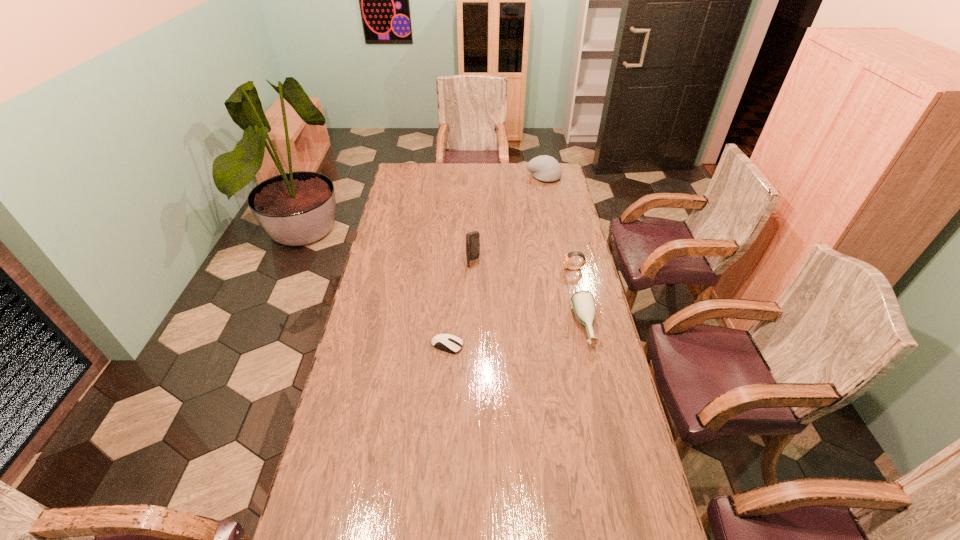
Where is `vacant space at the far edge of the desktop`? vacant space at the far edge of the desktop is located at coordinates (482, 166).

This screenshot has height=540, width=960. Identify the location of vacant region at the left edge of the desktop. (396, 271).

This screenshot has height=540, width=960. In order to click on free spot at the right edge of the desktop in this screenshot , I will do (x=560, y=322).

Locate an element on the screen. Image resolution: width=960 pixels, height=540 pixels. free space between the bottle and the beanie is located at coordinates (564, 252).

You are a GUI agent. You are given a task and a screenshot of the screen. Output one action in this format:
    pyautogui.click(x=<x>, y=<y>)
    Task: Click on the empty location between the watch and the shortest object
    The width and height of the screenshot is (960, 540).
    Given the screenshot: What is the action you would take?
    pyautogui.click(x=511, y=307)

This screenshot has height=540, width=960. What are the coordinates of `empty location between the beanie and the fourth object from right to left` in the screenshot? It's located at (509, 219).

I want to click on vacant space in between the bottle and the mouse, so click(516, 336).

What are the coordinates of `free space between the beanie and the watch` in the screenshot? It's located at (559, 223).

Find the location of a particular element. This screenshot has height=540, width=960. vacant region between the farthest object and the mouse is located at coordinates (495, 261).

This screenshot has height=540, width=960. In order to click on free space that is in between the farthest object and the bottle in this screenshot , I will do `click(564, 252)`.